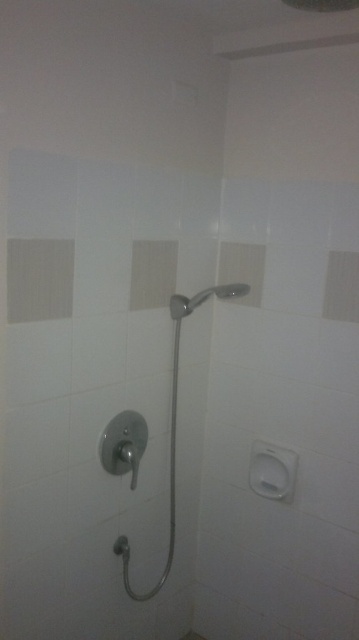
You are a plumber installing a new showerhead. The current silver metallic shower head at center is 5.97 inches away from the satin nickel shower handle at center. According to safety regulations, the minimum distance between the showerhead and the handle must be at least 6 inches. Is the current setup compliant with the safety regulations?

The silver metallic shower head at center and the satin nickel shower handle at center are 5.97 inches apart, which is less than the required 6 inches. Therefore, the current setup does not comply with the safety regulations.

You are standing in the shower area and notice two points marked on the wall. The first point is at coordinates point (182,308) and the second is at point (192,307). From your perspective facing the wall, which point is closer to you?

Point (192,307) is closer to you because point (182,308) is behind it.

You are standing in the bathroom and want to reach the point at coordinates point (174, 417). If your arm can extend 1.5 meters, can you reach it?

The point (174, 417) is 1.84 meters from the camera, which is beyond the 1.5 meters your arm can extend, so you cannot reach it.